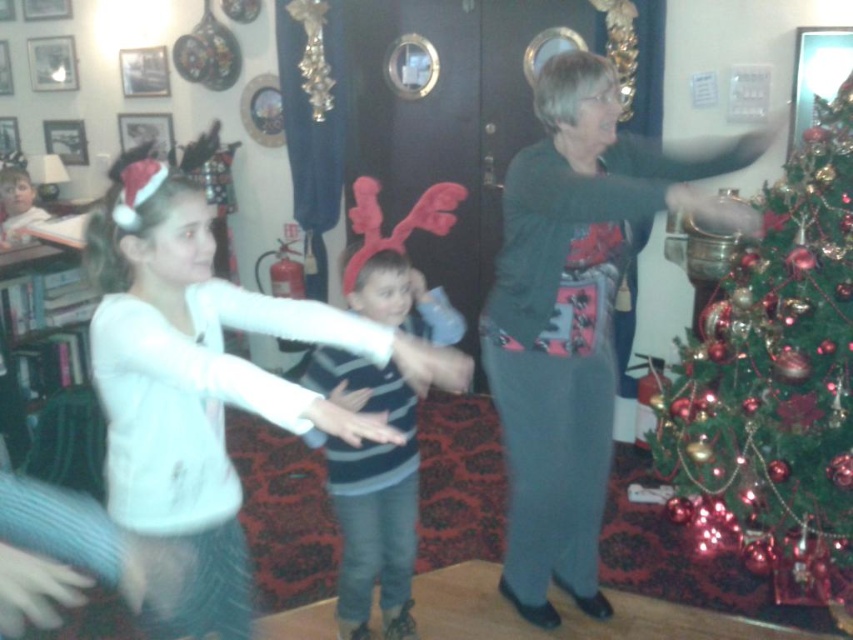
Question: Does dark gray sweater at center come in front of white matte sweater at center?

Choices:
 (A) yes
 (B) no

Answer: (B)

Question: Which point is closer to the camera?

Choices:
 (A) (509, 310)
 (B) (236, 400)

Answer: (B)

Question: Does white matte sweater at center appear on the left side of striped knit sweater at center?

Choices:
 (A) no
 (B) yes

Answer: (A)

Question: Which point is farther to the camera?

Choices:
 (A) (845, 490)
 (B) (547, 612)
 (C) (440, 323)

Answer: (A)

Question: Is dark gray sweater at center further to the viewer compared to striped knit sweater at center?

Choices:
 (A) no
 (B) yes

Answer: (A)

Question: Which point is closer to the camera?

Choices:
 (A) (781, 356)
 (B) (397, 529)

Answer: (B)